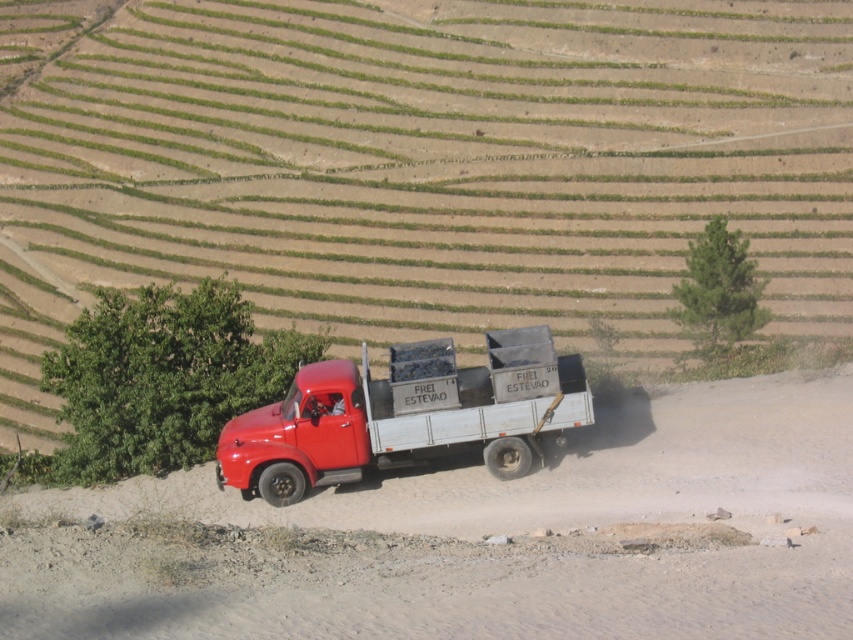
Does point (0, 566) come closer to viewer compared to point (517, 472)?

That is True.

Describe the element at coordinates (479, 538) in the screenshot. This screenshot has width=853, height=640. I see `dusty gravel road at lower center` at that location.

Which is behind, point (440, 561) or point (553, 406)?

Positioned behind is point (553, 406).

Find the location of a particular element. This screenshot has width=853, height=640. dusty gravel road at lower center is located at coordinates (479, 538).